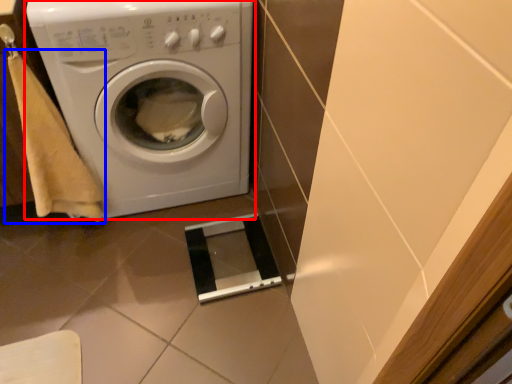
Question: Which of the following is the farthest to the observer, washing machine (highlighted by a red box) or hand towel (highlighted by a blue box)?

Choices:
 (A) washing machine
 (B) hand towel

Answer: (A)